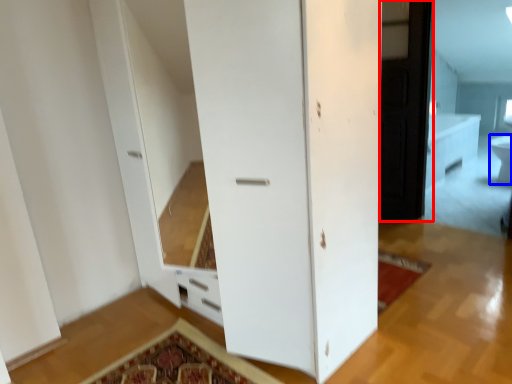
Question: Which object appears closest to the camera in this image, screen door (highlighted by a red box) or toilet bowl (highlighted by a blue box)?

Choices:
 (A) screen door
 (B) toilet bowl

Answer: (A)